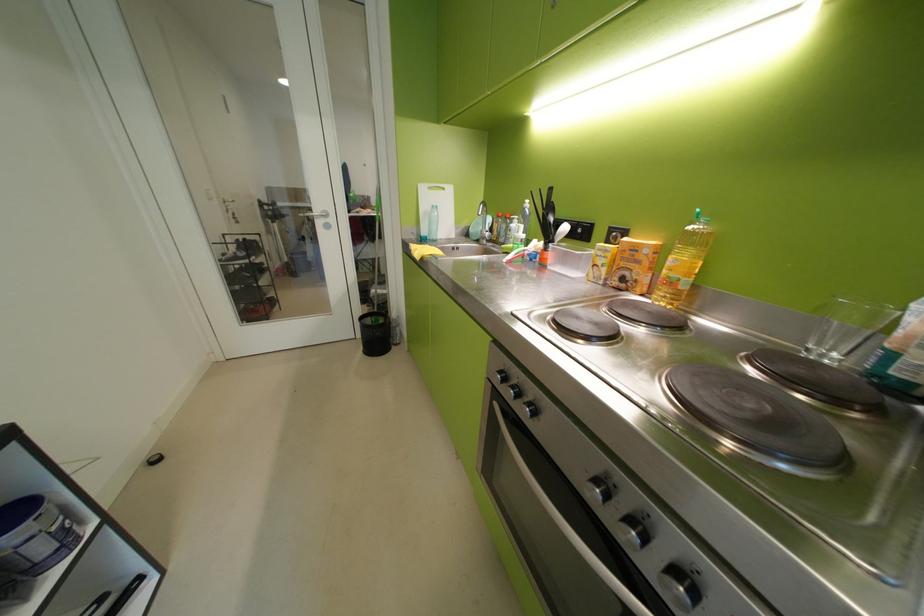
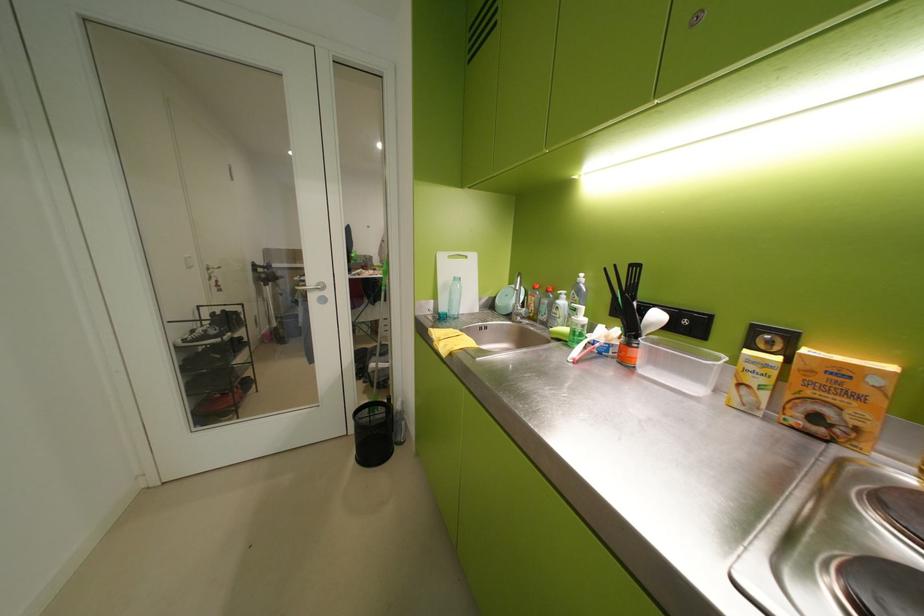
Locate, in the second image, the point that corresponds to point 646,249 in the first image.

(852, 373)